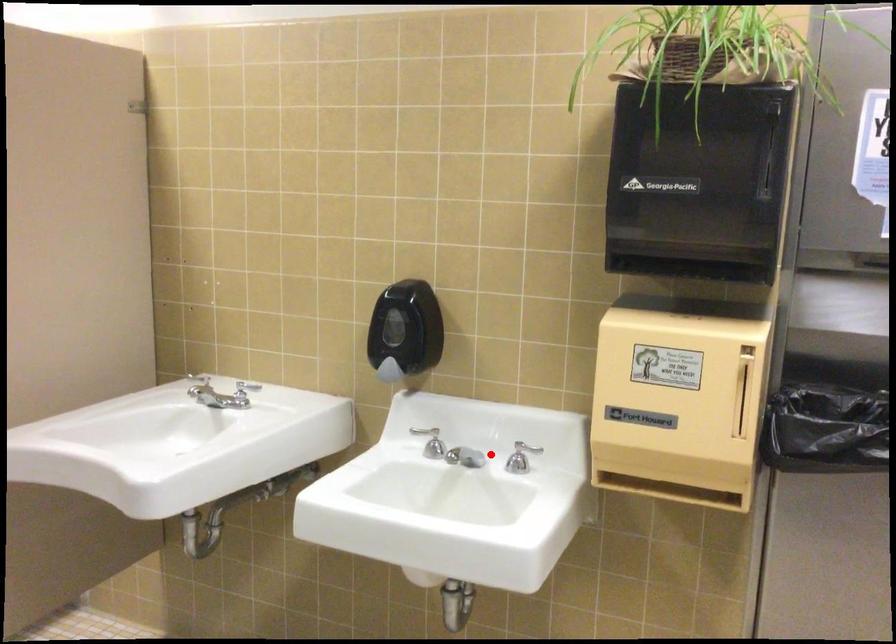
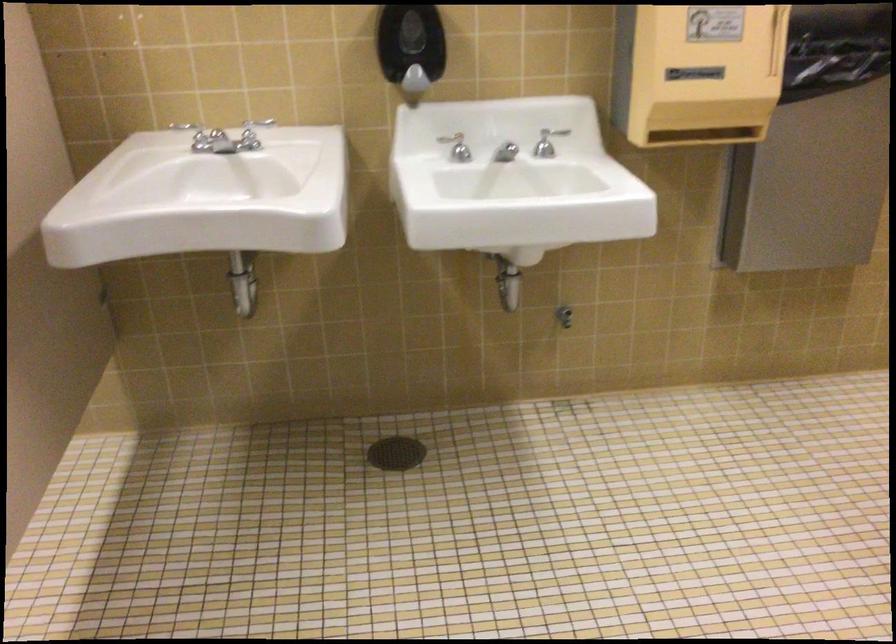
Find the pixel in the second image that matches the highlighted location in the first image.

(505, 152)